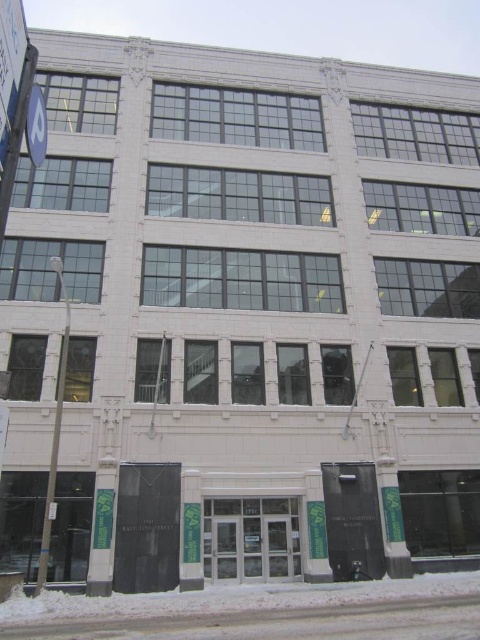
You are standing at the entrance of the multi story building and looking towards the lower center. What do you see at the point with coordinates [233,600]?

At the point with coordinates [233,600], you see white powdery snow at lower center.

You are a delivery person needing to park your van near the entrance of the building. The van requires a parking space that is at least 5 meters away from the white plastic parking sign at upper left. Can you park the van near the white powdery snow at lower center?

The white powdery snow at lower center and white plastic parking sign at upper left are 13.83 meters apart. Since the van needs to be at least 5 meters away from the white plastic parking sign at upper left, parking near the white powdery snow at lower center would satisfy this requirement as the distance is sufficient.

You are standing in front of the building and see the white powdery snow at lower center and the white plastic parking sign at upper left. Which object is closer to you?

The white powdery snow at lower center is closer to you because it is further to the viewer than the white plastic parking sign at upper left.